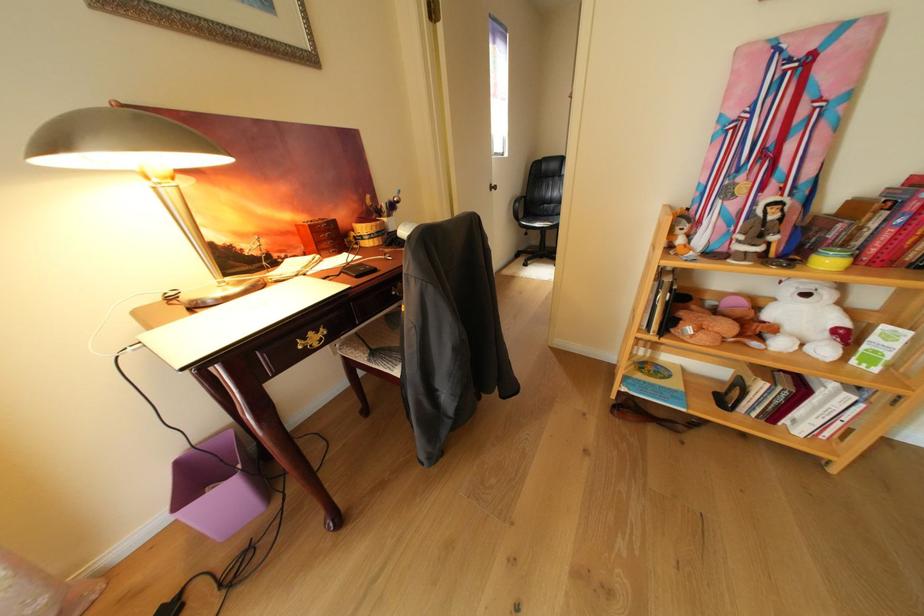
Find where to sit the chair sitting surface. Please return your answer as a coordinate pair (x, y).

(384, 342)